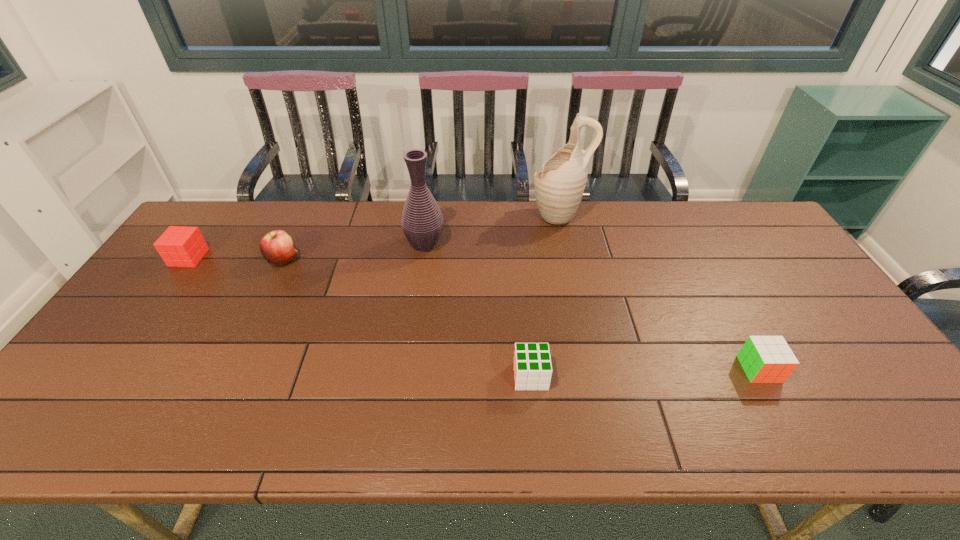
The width and height of the screenshot is (960, 540). I want to click on vase that is at the far edge, so click(x=422, y=222).

Locate an element on the screen. object present at the left edge is located at coordinates (180, 246).

Image resolution: width=960 pixels, height=540 pixels. In order to click on free space at the far edge of the desktop in this screenshot , I will do `click(601, 220)`.

The width and height of the screenshot is (960, 540). Identify the location of free space at the left edge. (115, 341).

Where is `blank space at the right edge of the desktop`? blank space at the right edge of the desktop is located at coordinates (793, 279).

This screenshot has height=540, width=960. I want to click on vacant space at the far left corner, so click(234, 205).

This screenshot has width=960, height=540. I want to click on free space at the far right corner of the desktop, so click(x=758, y=223).

You are a GUI agent. You are given a task and a screenshot of the screen. Output one action in this format:
    pyautogui.click(x=<x>, y=<y>)
    Task: Click on the free space between the pitcher and the vase
    
    Given the screenshot: What is the action you would take?
    pyautogui.click(x=492, y=230)

Image resolution: width=960 pixels, height=540 pixels. I want to click on empty space between the fourth object from right to left and the fourth shortest object, so click(354, 252).

The height and width of the screenshot is (540, 960). In order to click on free space that is in between the second cube from left to right and the leftmost cube in this screenshot , I will do `click(360, 317)`.